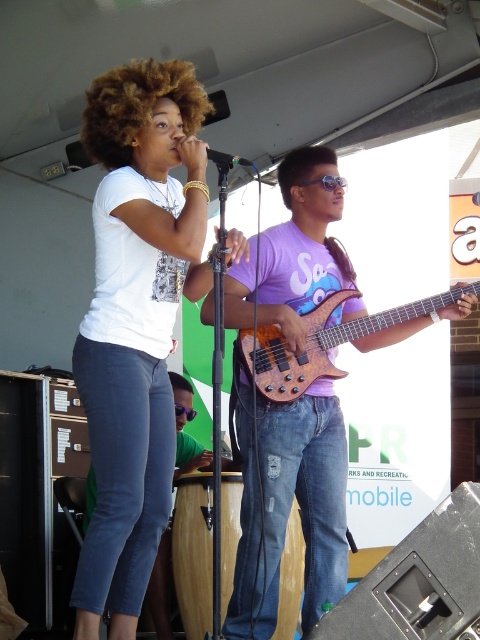
Does matte purple shirt at center have a greater width compared to metallic silver microphone at center?

Yes, matte purple shirt at center is wider than metallic silver microphone at center.

Who is more forward, [271,248] or [207,156]?

Point [207,156]

Does point (340, 484) come farther from viewer compared to point (214, 156)?

Yes.

The height and width of the screenshot is (640, 480). Find the location of `matte purple shirt at center`. matte purple shirt at center is located at coordinates (303, 496).

From the picture: Between white matte t-shirt at upper left and matte purple shirt at center, which one is positioned higher?

Positioned higher is white matte t-shirt at upper left.

In the scene shown: Is white matte t-shirt at upper left taller than matte purple shirt at center?

Correct, white matte t-shirt at upper left is much taller as matte purple shirt at center.

Does point (134, 467) lie in front of point (291, 253)?

Yes, it is.

Locate an element on the screen. This screenshot has width=480, height=640. white matte t-shirt at upper left is located at coordinates (135, 321).

Can you confirm if matte purple shirt at center is smaller than orange wood bass at center?

Actually, matte purple shirt at center might be larger than orange wood bass at center.

The width and height of the screenshot is (480, 640). What do you see at coordinates (303, 496) in the screenshot? I see `matte purple shirt at center` at bounding box center [303, 496].

Between point (309, 460) and point (344, 340), which one is positioned behind?

The point (344, 340) is more distant.

In order to click on matte purple shirt at center in this screenshot , I will do `click(303, 496)`.